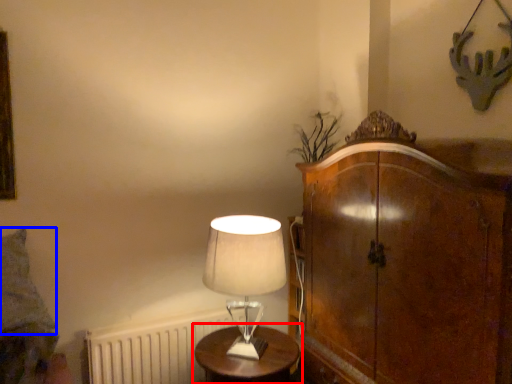
Question: Which point is further to the camera, table (highlighted by a red box) or pillow (highlighted by a blue box)?

Choices:
 (A) table
 (B) pillow

Answer: (A)